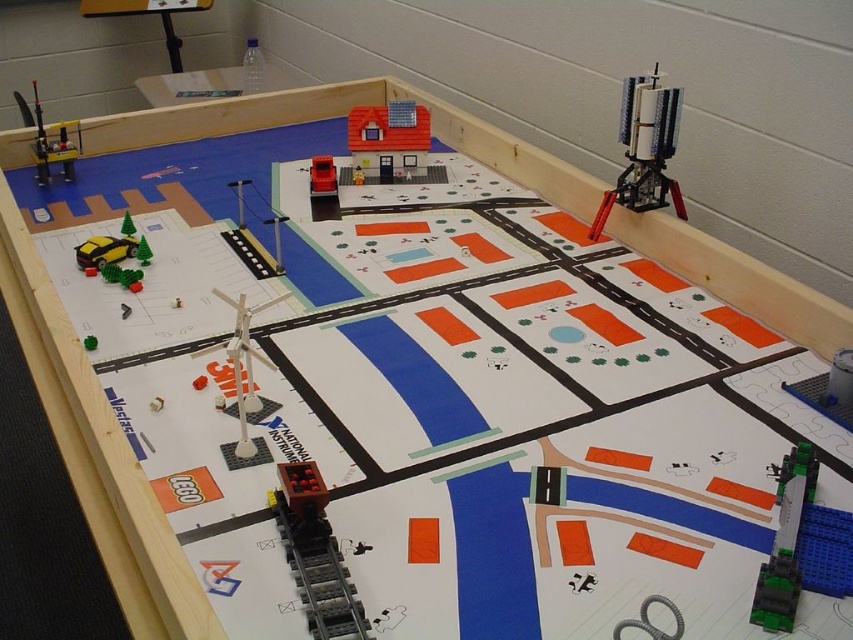
Question: Which point appears farthest from the camera in this image?

Choices:
 (A) (144, 256)
 (B) (386, 138)
 (C) (125, 225)
 (D) (245, 429)

Answer: (B)

Question: Is green matte tree at center-left thinner than green plastic car at lower left?

Choices:
 (A) yes
 (B) no

Answer: (A)

Question: Does translucent blue plastic house at center appear over green matte tree at center-left?

Choices:
 (A) yes
 (B) no

Answer: (A)

Question: Which object is closer to the camera taking this photo?

Choices:
 (A) brick red car at center
 (B) shiny yellow car at lower left
 (C) white plastic wind turbine at center

Answer: (C)

Question: Does translucent blue plastic house at center lie behind green plastic car at lower left?

Choices:
 (A) no
 (B) yes

Answer: (B)

Question: Which of the following is the farthest from the observer?

Choices:
 (A) (244, 332)
 (B) (314, 492)

Answer: (A)